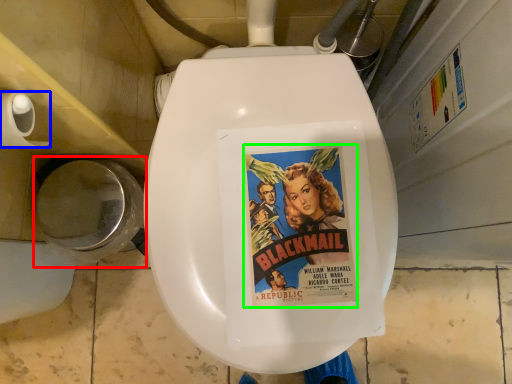
Question: Estimate the real-world distances between objects in this image. Which object is farther from toilet bowl (highlighted by a red box), toilet paper (highlighted by a blue box) or movie poster (highlighted by a green box)?

Choices:
 (A) toilet paper
 (B) movie poster

Answer: (B)